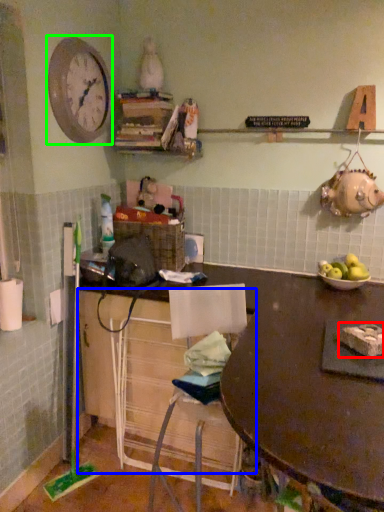
Question: Which object is the farthest from food (highlighted by a red box)? Choose among these: cabinetry (highlighted by a blue box) or clock (highlighted by a green box).

Choices:
 (A) cabinetry
 (B) clock

Answer: (B)